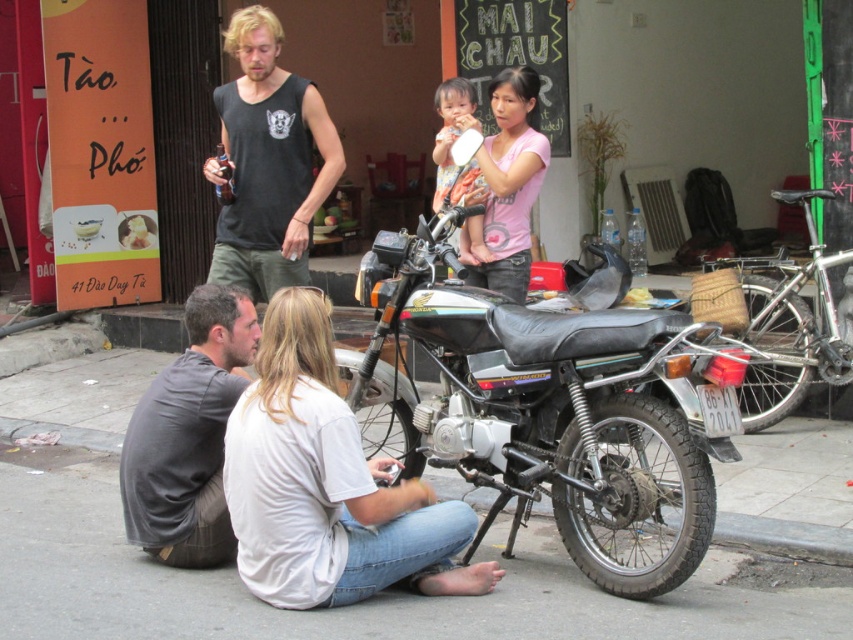
Question: Among these objects, which one is farthest from the camera?

Choices:
 (A) gray asphalt pavement at lower center
 (B) black sleeveless shirt at upper center

Answer: (B)

Question: Which point appears closest to the camera in this image?

Choices:
 (A) (212, 486)
 (B) (462, 497)
 (C) (548, 156)
 (D) (543, 410)

Answer: (A)

Question: Which is farther from the pink matte shirt at upper center?

Choices:
 (A) white matte shirt at lower center
 (B) black sleeveless shirt at upper center
 (C) silver metallic motorcycle at center
 (D) smooth plastic cup at center

Answer: (A)

Question: Is gray asphalt pavement at lower center smaller than white matte shirt at lower center?

Choices:
 (A) yes
 (B) no

Answer: (A)

Question: Does shiny metallic motorcycle at center appear over pink matte shirt at upper center?

Choices:
 (A) no
 (B) yes

Answer: (A)

Question: In this image, where is gray cotton shirt at lower left located relative to silver metallic motorcycle at center?

Choices:
 (A) left
 (B) right

Answer: (A)